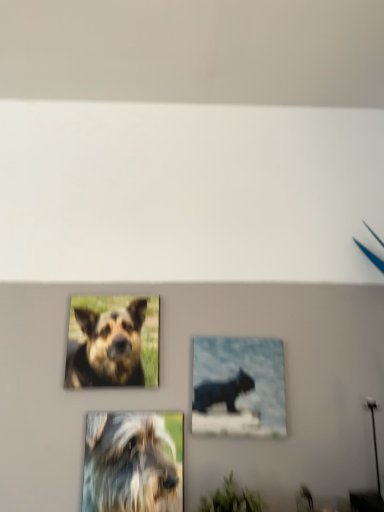
Question: Is matte black cat at center in front of or behind green matte plant at lower center in the image?

Choices:
 (A) front
 (B) behind

Answer: (B)

Question: Is matte black cat at center spatially inside green matte plant at lower center, or outside of it?

Choices:
 (A) inside
 (B) outside

Answer: (B)

Question: Which object is positioned farthest from the fuzzy fur dog at center, which is the second dog from top to bottom?

Choices:
 (A) matte black cat at center
 (B) brown fur dog at upper left, the first dog in the top-to-bottom sequence
 (C) green matte plant at lower center

Answer: (C)

Question: Estimate the real-world distances between objects in this image. Which object is closer to the matte black cat at center?

Choices:
 (A) fuzzy fur dog at center, the first dog ordered from the bottom
 (B) green matte plant at lower center
 (C) brown fur dog at upper left, the first dog in the top-to-bottom sequence

Answer: (A)